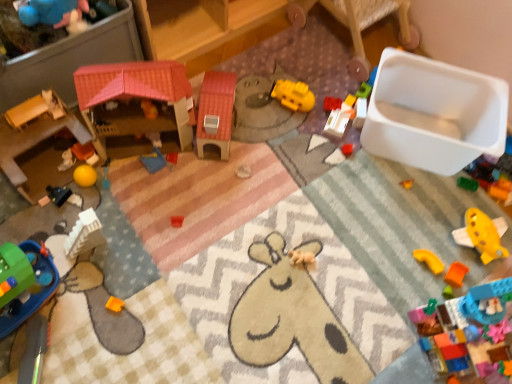
Find the location of a particular element. empty space that is in between white plastic container at center, acting as the 10th toy starting from the left, and blue plastic tray at center, acting as the 6th toy starting from the left is located at coordinates (251, 147).